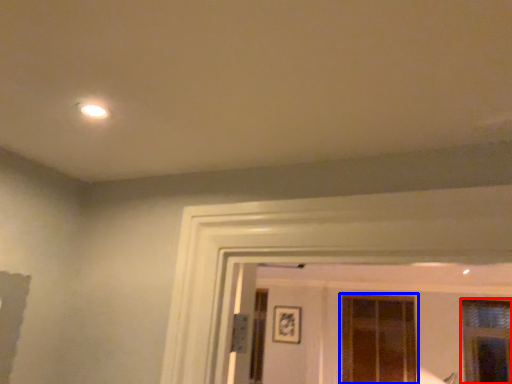
Question: Which object appears farthest to the camera in this image, window (highlighted by a red box) or window (highlighted by a blue box)?

Choices:
 (A) window
 (B) window

Answer: (B)